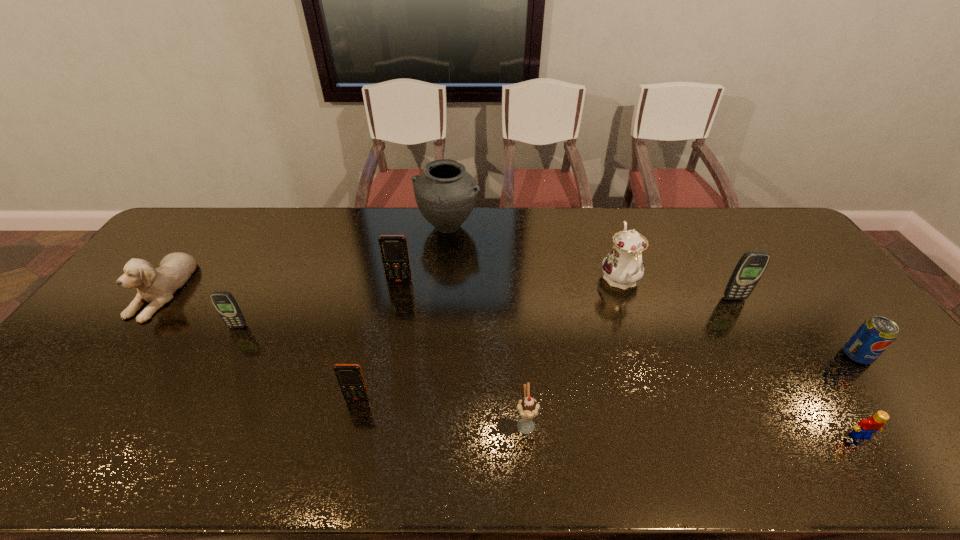
The height and width of the screenshot is (540, 960). What are the coordinates of `the third nearest object` in the screenshot? It's located at (350, 378).

Locate an element on the screen. Image resolution: width=960 pixels, height=540 pixels. the left gray cellular telephone is located at coordinates (225, 304).

The height and width of the screenshot is (540, 960). Identify the location of the leftmost cellular telephone. (225, 304).

The image size is (960, 540). I want to click on the fifth object from right to left, so click(528, 408).

Locate an element on the screen. soda is located at coordinates (875, 335).

Locate an element on the screen. the rightmost object is located at coordinates (875, 335).

This screenshot has width=960, height=540. I want to click on the shortest object, so click(x=866, y=427).

Identify the location of the second object from right to left. (866, 427).

Identify the location of free space located 0.070m on the right of the black urn. Image resolution: width=960 pixels, height=540 pixels. (499, 227).

Find the location of a particular element. free space located on the front of the fourth object from right to left is located at coordinates (664, 410).